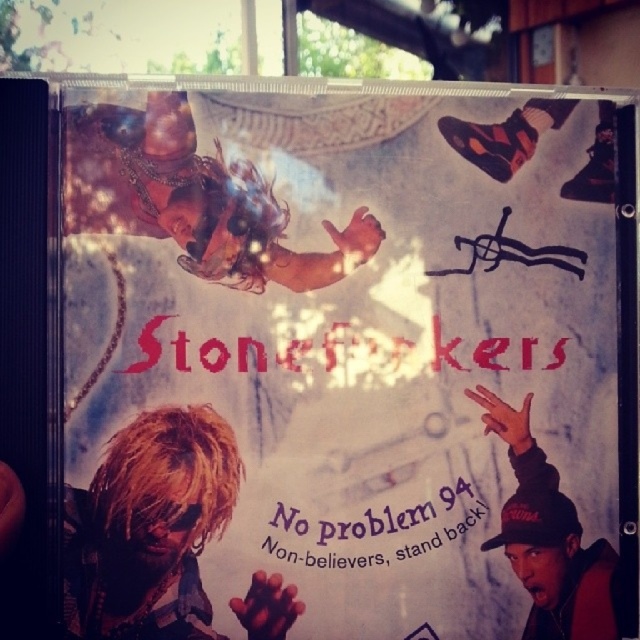
Who is more distant from viewer, (x=211, y=177) or (x=509, y=440)?

Point (x=509, y=440)

Between shiny gold necklace at upper center and matte black cap at lower right, which one appears on the left side from the viewer's perspective?

shiny gold necklace at upper center is more to the left.

This screenshot has width=640, height=640. Describe the element at coordinates (193, 198) in the screenshot. I see `shiny gold necklace at upper center` at that location.

At what (x,y) coordinates should I click in order to perform the action: click on shiny gold necklace at upper center. Please return your answer as a coordinate pair (x, y). Image resolution: width=640 pixels, height=640 pixels. Looking at the image, I should click on (193, 198).

Which of these two, blonde hair at lower left or matte black cap at lower right, stands shorter?

With less height is blonde hair at lower left.

Is point (118, 566) farther from viewer compared to point (490, 540)?

No.

The height and width of the screenshot is (640, 640). What are the coordinates of `blonde hair at lower left` in the screenshot? It's located at (148, 528).

Which is in front, point (125, 448) or point (269, 243)?

Point (125, 448)

This screenshot has height=640, width=640. Identify the location of blonde hair at lower left. point(148,528).

You are a GUI agent. You are given a task and a screenshot of the screen. Output one action in this format:
    pyautogui.click(x=<x>, y=<y>)
    Task: Click on the blonde hair at lower left
    The width and height of the screenshot is (640, 640).
    Given the screenshot: What is the action you would take?
    pyautogui.click(x=148, y=528)